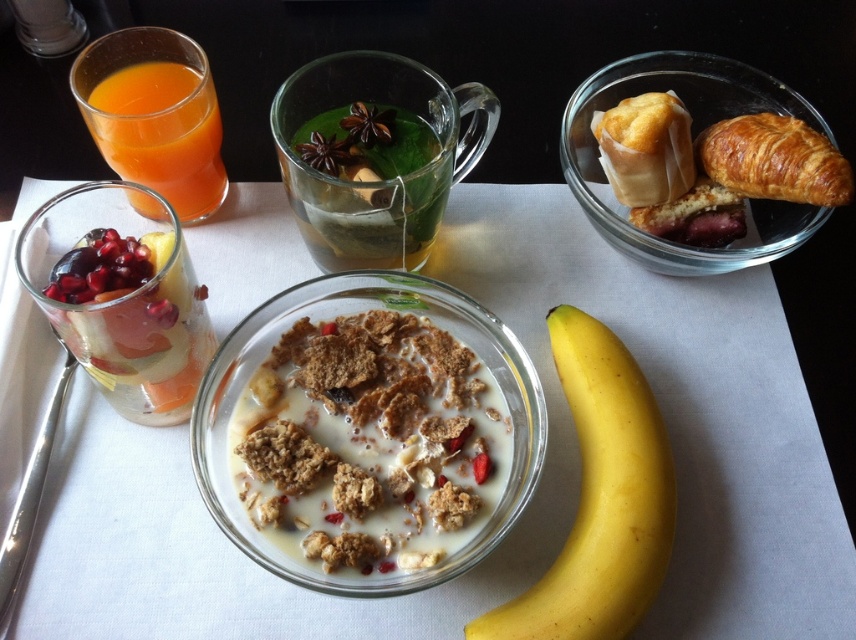
Between brown crunchy cereal at center and yellow smooth banana at center, which one has more height?

With more height is yellow smooth banana at center.

Which is in front, point (431, 464) or point (642, 484)?

Point (431, 464)

You are a GUI agent. You are given a task and a screenshot of the screen. Output one action in this format:
    pyautogui.click(x=<x>, y=<y>)
    Task: Click on the brown crunchy cereal at center
    This screenshot has height=640, width=856.
    Given the screenshot: What is the action you would take?
    tap(369, 442)

Can you confirm if brown crunchy cereal at center is positioned to the right of golden brown flaky croissant at upper right?

Incorrect, brown crunchy cereal at center is not on the right side of golden brown flaky croissant at upper right.

Does brown crunchy cereal at center have a lesser height compared to golden brown flaky croissant at upper right?

No.

This screenshot has height=640, width=856. In order to click on brown crunchy cereal at center in this screenshot , I will do `click(369, 442)`.

Does brown crunchy cereal at center have a lesser width compared to translucent glass at upper left?

Incorrect, brown crunchy cereal at center's width is not less than translucent glass at upper left's.

Who is lower down, brown crunchy cereal at center or translucent glass at upper left?

brown crunchy cereal at center is lower down.

Between point (462, 388) and point (134, 76), which one is positioned behind?

Point (134, 76)

The width and height of the screenshot is (856, 640). Find the location of `brown crunchy cereal at center`. brown crunchy cereal at center is located at coordinates (369, 442).